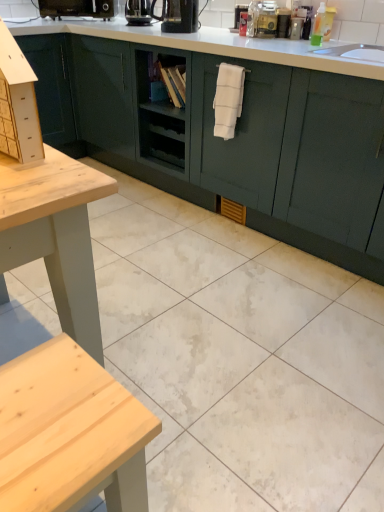
What are the coordinates of `vacant area that is situated to the right of translucent plastic bottle at upper right` in the screenshot? It's located at (353, 44).